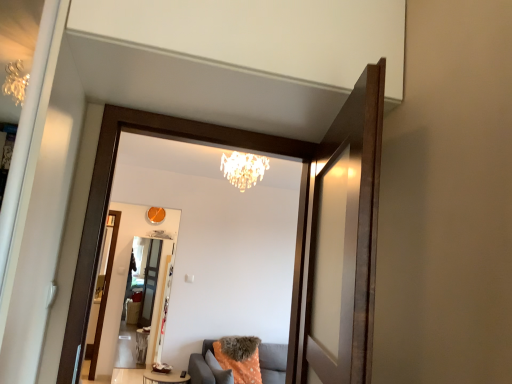
Question: Can you confirm if matte wooden mirror at center is positioned to the left of transparent glass screen door at upper center, which appears as the second screen door when viewed from the left?

Choices:
 (A) yes
 (B) no

Answer: (A)

Question: Is matte wooden mirror at center at the right side of transparent glass screen door at upper center, which is counted as the first screen door, starting from the right?

Choices:
 (A) no
 (B) yes

Answer: (A)

Question: Is matte wooden mirror at center bigger than transparent glass screen door at upper center, which is counted as the first screen door, starting from the right?

Choices:
 (A) no
 (B) yes

Answer: (B)

Question: Could transparent glass screen door at upper center, which appears as the second screen door when viewed from the left, be considered to be inside matte wooden mirror at center?

Choices:
 (A) yes
 (B) no

Answer: (B)

Question: Is matte wooden mirror at center aimed at transparent glass screen door at upper center, placed as the first screen door when sorted from top to bottom?

Choices:
 (A) yes
 (B) no

Answer: (A)

Question: Visually, is transparent glass screen door at upper center, which is the second screen door from back to front, positioned to the left or to the right of clear glass screen door at center, placed as the second screen door when sorted from right to left?

Choices:
 (A) right
 (B) left

Answer: (A)

Question: Is transparent glass screen door at upper center, which is the first screen door in front-to-back order, inside the boundaries of clear glass screen door at center, the 1th screen door from the left, or outside?

Choices:
 (A) inside
 (B) outside

Answer: (B)

Question: Considering the positions of point (326, 357) and point (155, 286), is point (326, 357) closer or farther from the camera than point (155, 286)?

Choices:
 (A) farther
 (B) closer

Answer: (B)

Question: Considering the positions of transparent glass screen door at upper center, which is counted as the first screen door, starting from the right, and clear glass screen door at center, the second screen door in the front-to-back sequence, in the image, is transparent glass screen door at upper center, which is counted as the first screen door, starting from the right, bigger or smaller than clear glass screen door at center, the second screen door in the front-to-back sequence,?

Choices:
 (A) big
 (B) small

Answer: (A)

Question: Does point (329, 306) appear closer or farther from the camera than point (224, 160)?

Choices:
 (A) closer
 (B) farther

Answer: (A)

Question: In the image, is transparent glass screen door at upper center, which is the second screen door from back to front, on the left side or the right side of crystal chandelier at upper center?

Choices:
 (A) right
 (B) left

Answer: (A)

Question: From a real-world perspective, is transparent glass screen door at upper center, which appears as the second screen door when viewed from the left, positioned above or below crystal chandelier at upper center?

Choices:
 (A) above
 (B) below

Answer: (B)

Question: Is transparent glass screen door at upper center, which is counted as the first screen door, starting from the right, taller or shorter than crystal chandelier at upper center?

Choices:
 (A) tall
 (B) short

Answer: (A)

Question: Looking at their shapes, would you say matte wooden mirror at center is wider or thinner than transparent glass screen door at upper center, placed as the first screen door when sorted from top to bottom?

Choices:
 (A) thin
 (B) wide

Answer: (B)

Question: Considering the positions of matte wooden mirror at center and transparent glass screen door at upper center, which is the second screen door from back to front, in the image, is matte wooden mirror at center taller or shorter than transparent glass screen door at upper center, which is the second screen door from back to front,?

Choices:
 (A) short
 (B) tall

Answer: (B)